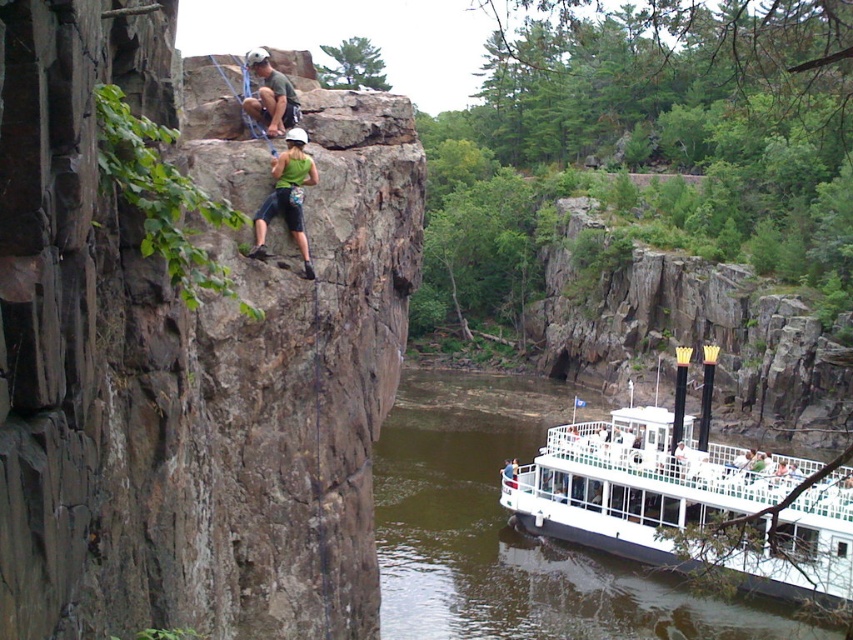
Does rusty stone cliff at upper center have a smaller size compared to white wooden boat at lower right?

Indeed, rusty stone cliff at upper center has a smaller size compared to white wooden boat at lower right.

The width and height of the screenshot is (853, 640). Describe the element at coordinates (189, 355) in the screenshot. I see `rusty stone cliff at upper center` at that location.

I want to click on rusty stone cliff at upper center, so click(189, 355).

Who is more forward, (283, 496) or (294, 168)?

Point (294, 168) is more forward.

Is point (361, 428) closer to viewer compared to point (257, 248)?

No, (361, 428) is behind (257, 248).

Who is more distant from viewer, (397, 211) or (297, 144)?

The point (397, 211) is more distant.

The height and width of the screenshot is (640, 853). Identify the location of rusty stone cliff at upper center. (189, 355).

From the picture: Is white wooden boat at lower right further to the viewer compared to green fabric climbing harness at center?

No, white wooden boat at lower right is in front of green fabric climbing harness at center.

Looking at this image, can you confirm if white wooden boat at lower right is taller than green fabric climbing harness at center?

Yes.

Is point (683, 380) positioned behind point (279, 196)?

Yes.

Locate an element on the screen. The image size is (853, 640). white wooden boat at lower right is located at coordinates (691, 499).